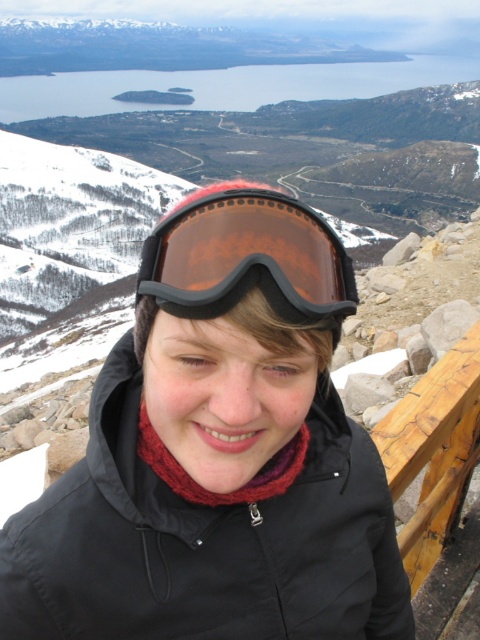
Question: Which of the following is the farthest from the observer?

Choices:
 (A) (350, 598)
 (B) (297, 276)

Answer: (A)

Question: Among these objects, which one is farthest from the camera?

Choices:
 (A) black fabric jacket at center
 (B) transparent plastic goggles at center

Answer: (A)

Question: Among these objects, which one is nearest to the camera?

Choices:
 (A) black fabric jacket at center
 (B) transparent plastic goggles at center

Answer: (B)

Question: Does transparent plastic goggles at center have a lesser width compared to black fabric jacket at center?

Choices:
 (A) yes
 (B) no

Answer: (A)

Question: Does transparent plastic goggles at center appear over black fabric jacket at center?

Choices:
 (A) yes
 (B) no

Answer: (A)

Question: Does transparent plastic goggles at center have a larger size compared to black fabric jacket at center?

Choices:
 (A) yes
 (B) no

Answer: (B)